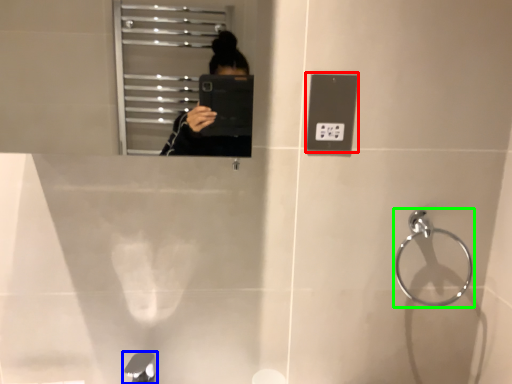
Question: Estimate the real-world distances between objects in this image. Which object is closer to light switch (highlighted by a red box), tap (highlighted by a blue box) or towel bar (highlighted by a green box)?

Choices:
 (A) tap
 (B) towel bar

Answer: (B)